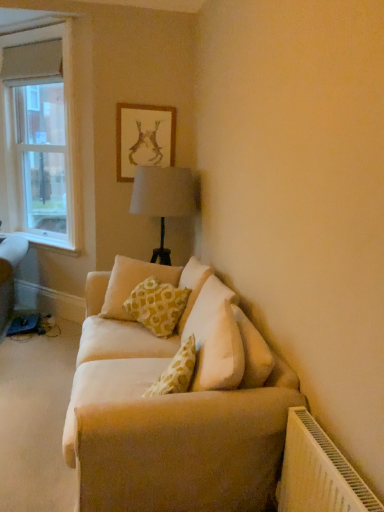
What is the approximate height of white wood at left?

5.06 inches.

At what (x,y) coordinates should I click in order to perform the action: click on gold-framed artwork at upper center. Please return your answer as a coordinate pair (x, y). Looking at the image, I should click on (144, 138).

Can you confirm if clear glass window at left is positioned to the right of yellow printed cushion at center?

No.

From a real-world perspective, between clear glass window at left and yellow printed cushion at center, who is vertically lower?

yellow printed cushion at center, from a real-world perspective.

How distant is clear glass window at left from yellow printed cushion at center?

1.67 meters.

Is clear glass window at left not within yellow printed cushion at center?

Absolutely, clear glass window at left is external to yellow printed cushion at center.

From a real-world perspective, is yellow printed cushion at center positioned above or below beige fabric couch at center?

Clearly, from a real-world perspective, yellow printed cushion at center is above beige fabric couch at center.

From the image's perspective, is yellow printed cushion at center beneath beige fabric couch at center?

No, from the image's perspective, yellow printed cushion at center is not below beige fabric couch at center.

Considering the relative positions of yellow printed cushion at center and beige fabric couch at center in the image provided, is yellow printed cushion at center to the left or to the right of beige fabric couch at center?

From the image, it's evident that yellow printed cushion at center is to the right of beige fabric couch at center.

From the picture: Is yellow printed cushion at center taller or shorter than beige fabric couch at center?

Clearly, yellow printed cushion at center is taller compared to beige fabric couch at center.

Which of these two, clear glass window at left or gold-framed artwork at upper center, stands shorter?

Standing shorter between the two is gold-framed artwork at upper center.

Is point (29, 182) positioned in front of point (121, 103)?

That is False.

Which of these two, clear glass window at left or gold-framed artwork at upper center, is wider?

Wider between the two is clear glass window at left.

Considering the positions of point (27, 238) and point (50, 169), is point (27, 238) closer or farther from the camera than point (50, 169)?

Point (27, 238) is positioned closer to the camera compared to point (50, 169).

Does white wood at left have a smaller size compared to clear glass window at left?

Indeed, white wood at left has a smaller size compared to clear glass window at left.

Is there a large distance between white wood at left and clear glass window at left?

white wood at left is near clear glass window at left, not far away.

From a real-world perspective, between white wood at left and clear glass window at left, who is vertically higher?

In real-world perspective, clear glass window at left is above.

Where is `studio couch below the yellow printed cushion at center (from the image's perspective)`? Image resolution: width=384 pixels, height=512 pixels. studio couch below the yellow printed cushion at center (from the image's perspective) is located at coordinates (175, 404).

From the picture: Considering the relative positions of beige fabric couch at center and yellow printed cushion at center in the image provided, is beige fabric couch at center to the left or to the right of yellow printed cushion at center?

Clearly, beige fabric couch at center is on the left of yellow printed cushion at center in the image.

Would you consider beige fabric couch at center to be distant from yellow printed cushion at center?

beige fabric couch at center is actually quite close to yellow printed cushion at center.

From the image's perspective, is beige fabric couch at center beneath yellow printed cushion at center?

Yes.

Is beige fabric couch at center aimed at white wood at left?

No, beige fabric couch at center is not facing towards white wood at left.

Would you say beige fabric couch at center contains white wood at left?

No, white wood at left is not surrounded by beige fabric couch at center.

From the picture: From a real-world perspective, who is located higher, beige fabric couch at center or white wood at left?

In real-world perspective, white wood at left is above.

Is the surface of beige fabric couch at center in direct contact with white wood at left?

No, beige fabric couch at center is not touching white wood at left.

Is gold-framed artwork at upper center aimed at beige fabric couch at center?

No, gold-framed artwork at upper center does not turn towards beige fabric couch at center.

Which object is further away from the camera, gold-framed artwork at upper center or beige fabric couch at center?

gold-framed artwork at upper center is behind.

Can you tell me how much gold-framed artwork at upper center and beige fabric couch at center differ in facing direction?

0.883 degrees separate the facing orientations of gold-framed artwork at upper center and beige fabric couch at center.

Which object is thinner, gold-framed artwork at upper center or beige fabric couch at center?

gold-framed artwork at upper center is thinner.

At what (x,y) coordinates should I click in order to perform the action: click on window positioned vertically above the yellow printed cushion at center (from a real-world perspective). Please return your answer as a coordinate pair (x, y). Looking at the image, I should click on (41, 136).

You are a GUI agent. You are given a task and a screenshot of the screen. Output one action in this format:
    pyautogui.click(x=<x>, y=<y>)
    Task: Click on the studio couch below the yellow printed cushion at center (from the image's perspective)
    The image size is (384, 512).
    Given the screenshot: What is the action you would take?
    pyautogui.click(x=175, y=404)

Based on their spatial positions, is beige fabric couch at center or yellow printed cushion at center further from gold-framed artwork at upper center?

Among the two, beige fabric couch at center is located further to gold-framed artwork at upper center.

From the image, which object appears to be nearer to white wood at left, yellow printed cushion at center or beige fabric couch at center?

yellow printed cushion at center is closer to white wood at left.

From the image, which object appears to be nearer to clear glass window at left, gold-framed artwork at upper center or yellow printed cushion at center?

Based on the image, gold-framed artwork at upper center appears to be nearer to clear glass window at left.

Based on their spatial positions, is white wood at left or beige fabric couch at center closer to yellow printed cushion at center?

Based on the image, beige fabric couch at center appears to be nearer to yellow printed cushion at center.

When comparing their distances from clear glass window at left, does yellow printed cushion at center or gold-framed artwork at upper center seem further?

yellow printed cushion at center lies further to clear glass window at left than the other object.

Considering their positions, is clear glass window at left positioned further to gold-framed artwork at upper center than white wood at left?

The object further to gold-framed artwork at upper center is white wood at left.

From the picture: From the image, which object appears to be nearer to gold-framed artwork at upper center, beige fabric couch at center or clear glass window at left?

Based on the image, clear glass window at left appears to be nearer to gold-framed artwork at upper center.

Looking at the image, which one is located closer to clear glass window at left, white wood at left or gold-framed artwork at upper center?

gold-framed artwork at upper center is positioned closer to the anchor clear glass window at left.

The image size is (384, 512). I want to click on pillow positioned between beige fabric couch at center and gold-framed artwork at upper center from near to far, so click(x=132, y=283).

You are a GUI agent. You are given a task and a screenshot of the screen. Output one action in this format:
    pyautogui.click(x=<x>, y=<y>)
    Task: Click on the picture frame between beige fabric couch at center and white wood at left along the z-axis
    The height and width of the screenshot is (512, 384).
    Given the screenshot: What is the action you would take?
    pyautogui.click(x=144, y=138)

You are a GUI agent. You are given a task and a screenshot of the screen. Output one action in this format:
    pyautogui.click(x=<x>, y=<y>)
    Task: Click on the picture frame between white wood at left and yellow printed cushion at center in the horizontal direction
    Image resolution: width=384 pixels, height=512 pixels.
    Given the screenshot: What is the action you would take?
    pyautogui.click(x=144, y=138)

Identify the location of window sill between clear glass window at left and yellow printed cushion at center vertically. (48, 245).